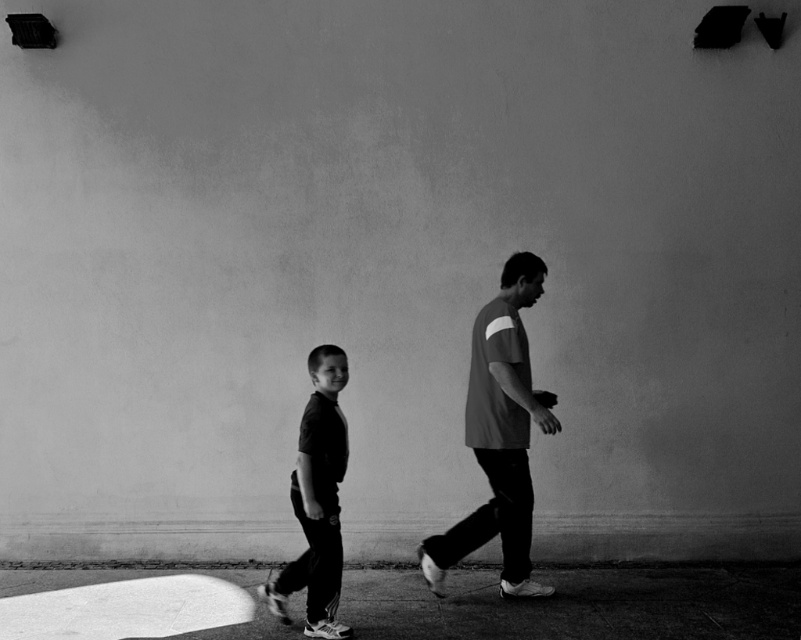
Is gray cotton shirt at center shorter than dark gray fabric pants at left?

No.

Is gray cotton shirt at center below dark gray fabric pants at left?

No.

Locate an element on the screen. The height and width of the screenshot is (640, 801). gray cotton shirt at center is located at coordinates (498, 435).

The height and width of the screenshot is (640, 801). What are the coordinates of `gray cotton shirt at center` in the screenshot? It's located at (498, 435).